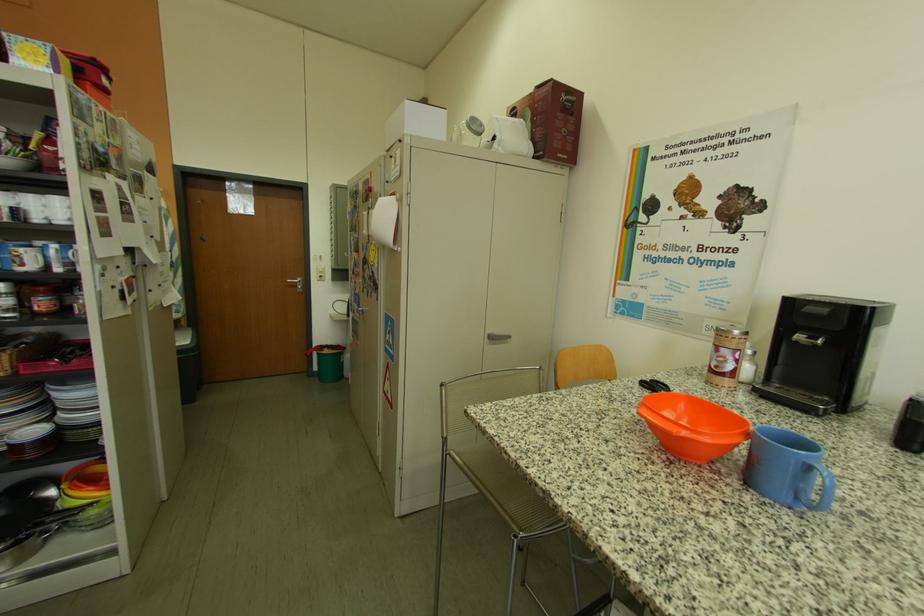
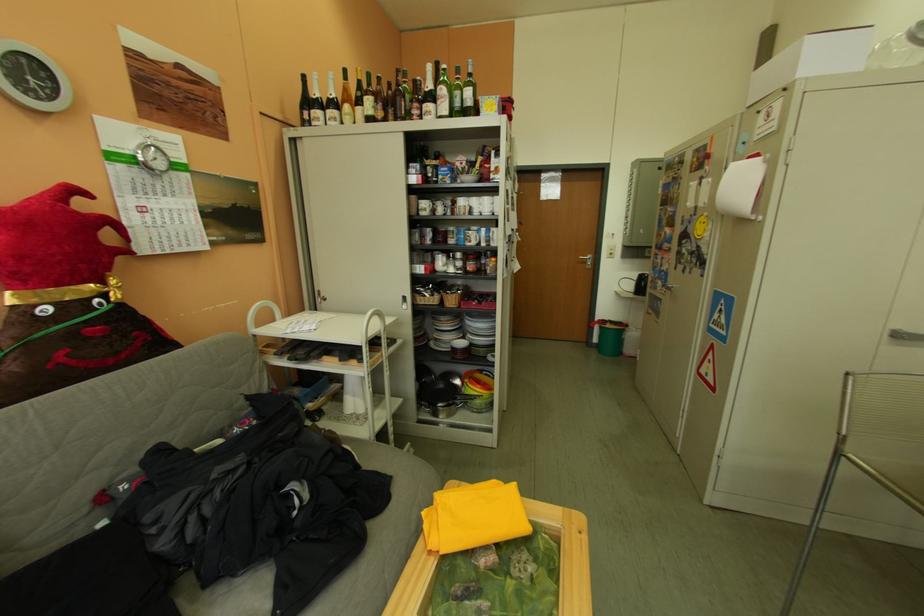
Locate, in the second image, the point that corresponds to the point at 331,357 in the first image.

(613, 330)